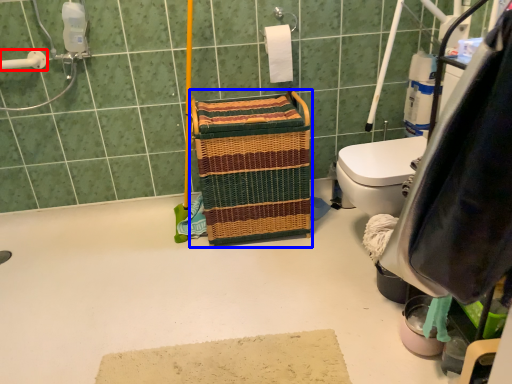
Question: Which object is closer to the camera taking this photo, shower (highlighted by a red box) or laundry basket (highlighted by a blue box)?

Choices:
 (A) shower
 (B) laundry basket

Answer: (B)